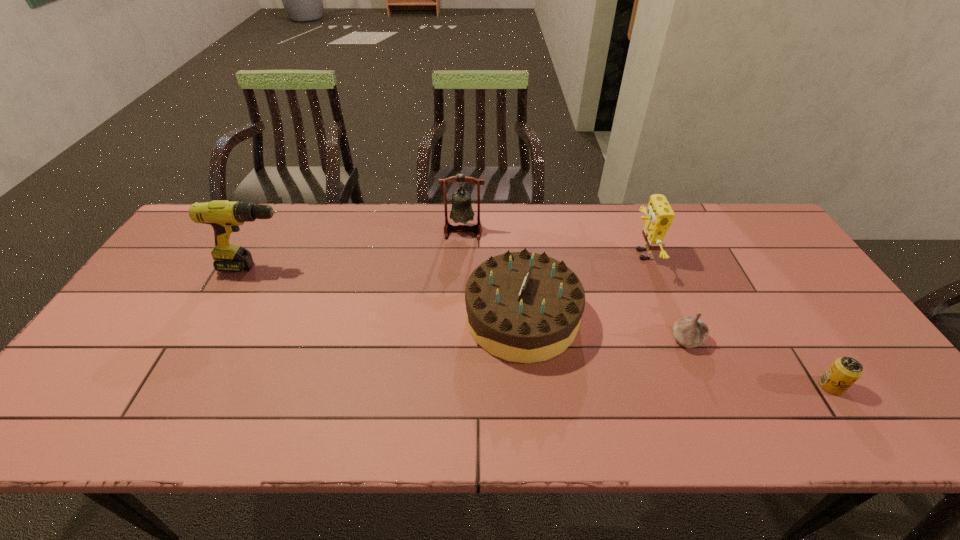
Identify which object is the third closest to the leftmost object. Please provide its 2D coordinates. Your answer should be formatted as a tuple, i.e. [(x, y)], where the tuple contains the x and y coordinates of a point satisfying the conditions above.

[(659, 216)]

Locate which object is the fifth closest to the bell. Please provide its 2D coordinates. Your answer should be formatted as a tuple, i.e. [(x, y)], where the tuple contains the x and y coordinates of a point satisfying the conditions above.

[(845, 371)]

The width and height of the screenshot is (960, 540). Identify the location of free spot that satisfies the following two spatial constraints: 1. on the face of the nearest object; 2. on the right side of the sponge. (694, 386).

Locate an element on the screen. This screenshot has height=540, width=960. vacant position in the image that satisfies the following two spatial constraints: 1. on the back side of the nearest object; 2. on the face of the sponge is located at coordinates (745, 254).

Locate an element on the screen. The height and width of the screenshot is (540, 960). free spot that satisfies the following two spatial constraints: 1. on the front-facing side of the birthday cake; 2. on the back side of the shortest object is located at coordinates (528, 386).

Where is `free space in the image that satisfies the following two spatial constraints: 1. on the back side of the beer can; 2. on the face of the sponge`? free space in the image that satisfies the following two spatial constraints: 1. on the back side of the beer can; 2. on the face of the sponge is located at coordinates click(x=745, y=254).